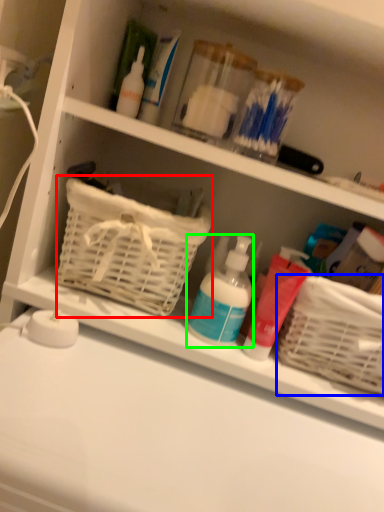
Question: Which is farther away from basket (highlighted by a red box)? basket (highlighted by a blue box) or cleaning product (highlighted by a green box)?

Choices:
 (A) basket
 (B) cleaning product

Answer: (A)